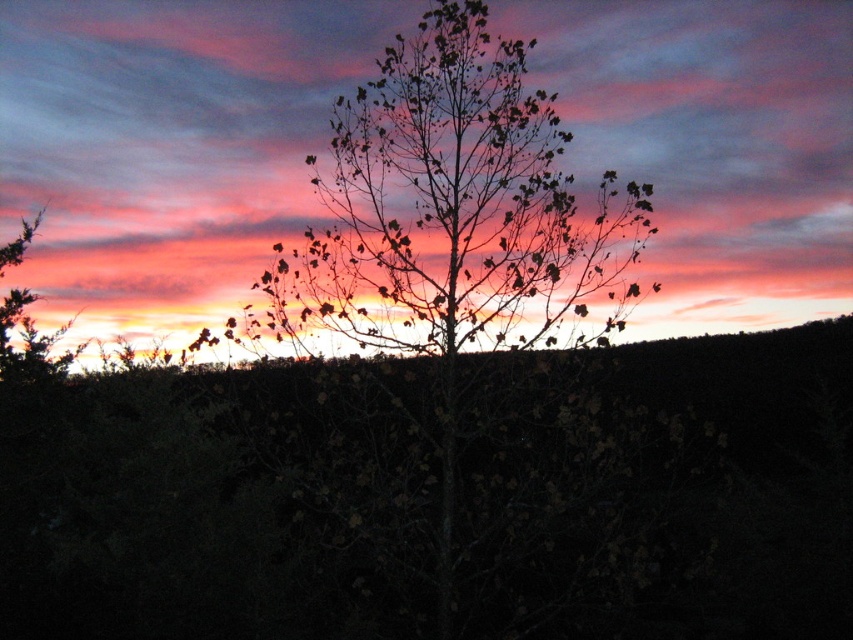
Question: Is pink matte cloud at upper center to the right of silhouette tree at center from the viewer's perspective?

Choices:
 (A) yes
 (B) no

Answer: (B)

Question: Does pink matte cloud at upper center have a larger size compared to silhouette tree at center?

Choices:
 (A) no
 (B) yes

Answer: (A)

Question: Is pink matte cloud at upper center further to the viewer compared to silhouette tree at center?

Choices:
 (A) no
 (B) yes

Answer: (B)

Question: Which point is farther to the camera?

Choices:
 (A) pink matte cloud at upper center
 (B) silhouette tree at center

Answer: (A)